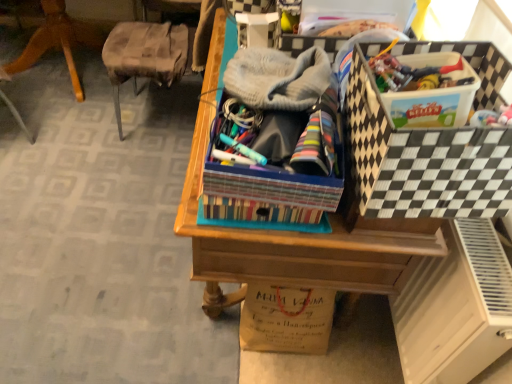
You are a GUI agent. You are given a task and a screenshot of the screen. Output one action in this format:
    pyautogui.click(x=<x>, y=<y>)
    Task: Click on the free space to the left of brown paper bag at lower center
    The image size is (512, 384).
    Given the screenshot: What is the action you would take?
    pyautogui.click(x=198, y=329)